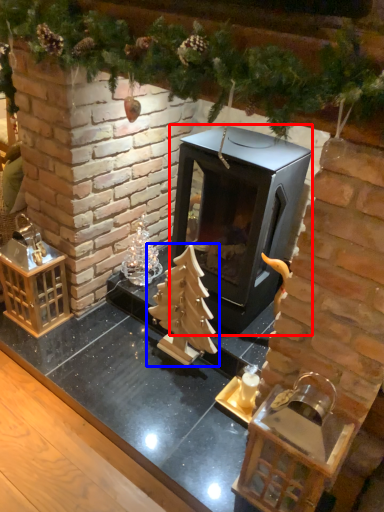
Question: Among these objects, which one is nearest to the camera, fireplace (highlighted by a red box) or christmas tree (highlighted by a blue box)?

Choices:
 (A) fireplace
 (B) christmas tree

Answer: (A)